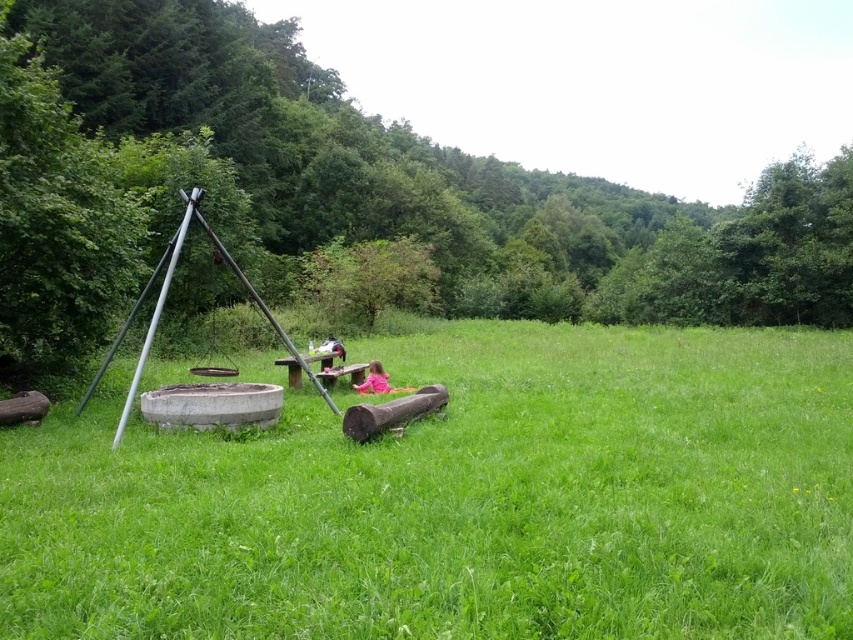
Question: Among these objects, which one is nearest to the camera?

Choices:
 (A) green grass at center
 (B) green leafy tree at center
 (C) pink fabric at center

Answer: (A)

Question: Which of the following is the closest to the observer?

Choices:
 (A) green leafy tree at center
 (B) pink fabric at center
 (C) green grass at center

Answer: (C)

Question: Is green grass at center to the right of green leafy tree at center from the viewer's perspective?

Choices:
 (A) yes
 (B) no

Answer: (B)

Question: Is green leafy tree at center to the right of pink fabric at center from the viewer's perspective?

Choices:
 (A) no
 (B) yes

Answer: (B)

Question: Which point is farther to the camera?

Choices:
 (A) pink fabric at center
 (B) green grass at center
 (C) green leafy tree at center

Answer: (A)

Question: Where is green leafy tree at center located in relation to pink fabric at center in the image?

Choices:
 (A) left
 (B) right

Answer: (B)